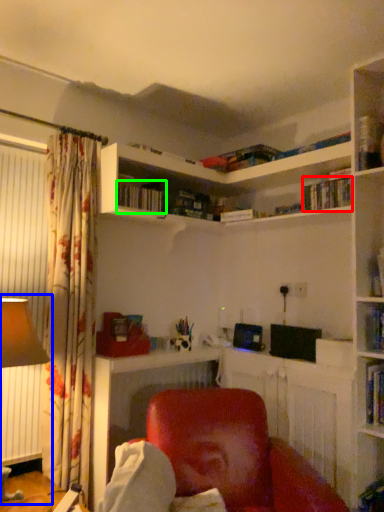
Question: Which object is the farthest from book (highlighted by a red box)? Choose among these: table lamp (highlighted by a blue box) or book (highlighted by a green box).

Choices:
 (A) table lamp
 (B) book

Answer: (A)